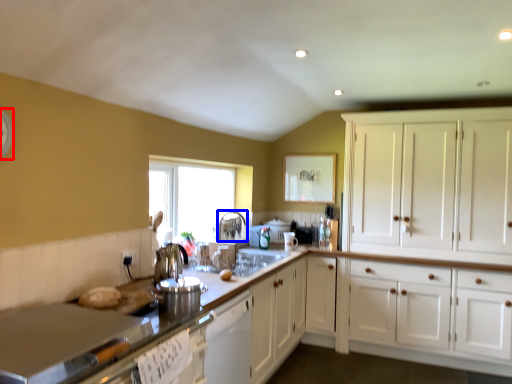
Question: Among these objects, which one is nearest to the camera, clock (highlighted by a red box) or faucet (highlighted by a blue box)?

Choices:
 (A) clock
 (B) faucet

Answer: (A)